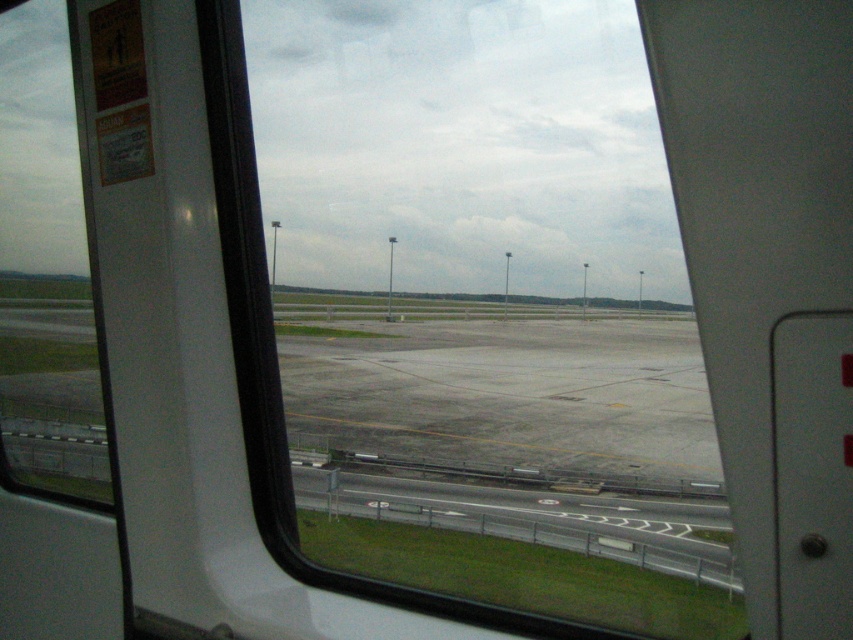
You are inside a vehicle and want to check the runway markings outside. Which window should you look through to see the runway closer? The transparent glass window at center or the transparent glass window at left?

The transparent glass window at center is located below the transparent glass window at left. Since it is lower, it would provide a closer view of the runway markings below.

You are a delivery drone operator trying to navigate through the airport tarmac. You have two windows to choose from to exit the building. The transparent glass window at center and the transparent glass window at left. Which window should you choose if you need more width to exit safely?

The transparent glass window at center might be wider than transparent glass window at left, so you should choose the transparent glass window at center to exit safely.